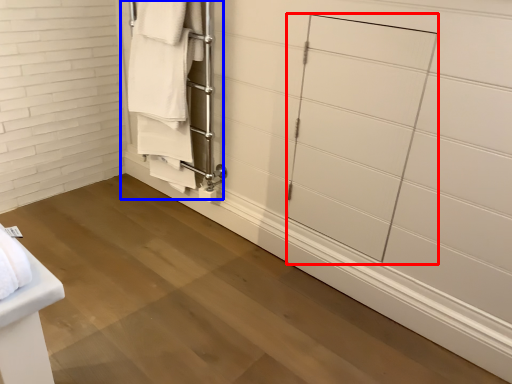
Question: Among these objects, which one is nearest to the camera, glass door (highlighted by a red box) or closet (highlighted by a blue box)?

Choices:
 (A) glass door
 (B) closet

Answer: (A)